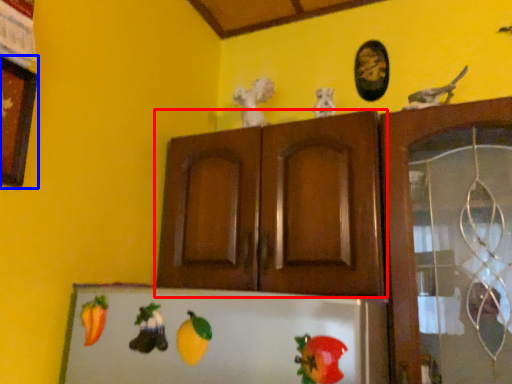
Question: Which point is closer to the camera, cabinetry (highlighted by a red box) or picture frame (highlighted by a blue box)?

Choices:
 (A) cabinetry
 (B) picture frame

Answer: (B)